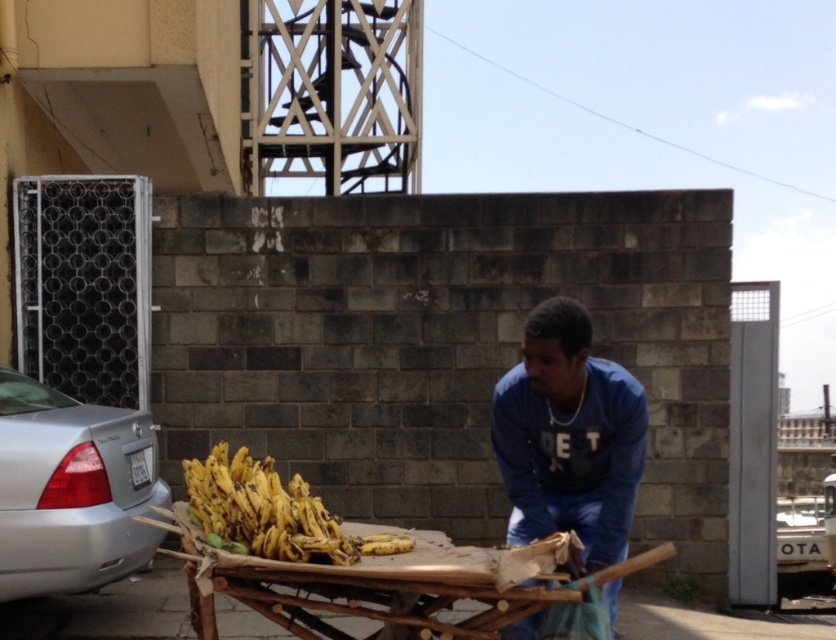
Question: Does yellow matte bananas at center have a smaller size compared to yellow matte bananas at lower center?

Choices:
 (A) no
 (B) yes

Answer: (A)

Question: Which of the following is the closest to the observer?

Choices:
 (A) (4, 464)
 (B) (590, 358)

Answer: (B)

Question: Can you confirm if blue cotton shirt at center is bigger than yellow matte bananas at lower center?

Choices:
 (A) no
 (B) yes

Answer: (B)

Question: Which point appears farthest from the camera in this image?

Choices:
 (A) (364, 538)
 (B) (558, 376)

Answer: (A)

Question: Which point is closer to the camera?

Choices:
 (A) coord(196,570)
 (B) coord(543,394)
 (C) coord(365,540)
 (D) coord(102,445)

Answer: (A)

Question: Does blue cotton shirt at center appear over silver metallic car at left?

Choices:
 (A) yes
 (B) no

Answer: (A)